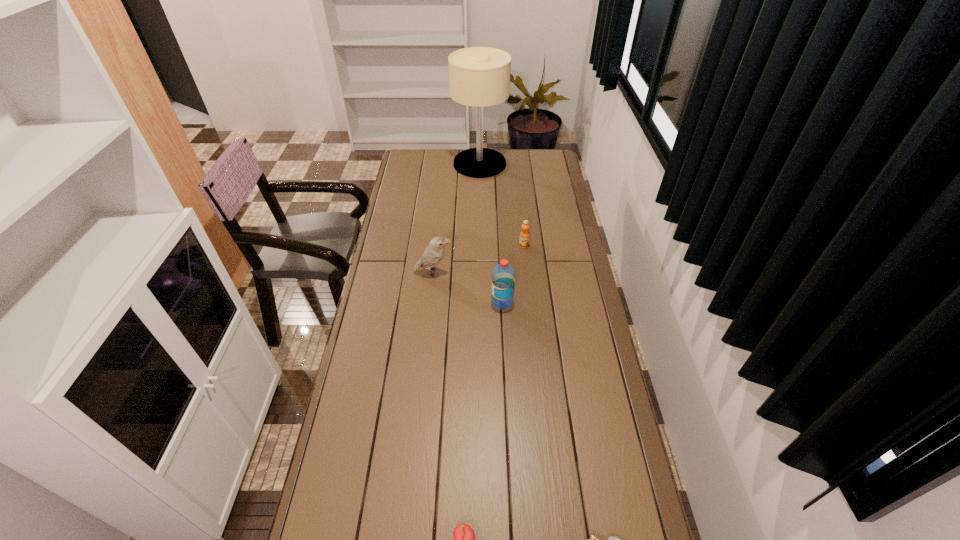
The height and width of the screenshot is (540, 960). In order to click on vacant region located at the face of the bird in this screenshot , I will do `click(524, 272)`.

Image resolution: width=960 pixels, height=540 pixels. Identify the location of vacant area located on the front label of the fourth tallest object. (526, 262).

Where is `object that is at the far edge`? object that is at the far edge is located at coordinates (478, 76).

Identify the location of object that is positioned at the left edge. (432, 255).

Where is `vacant area at the far edge of the desktop`? The image size is (960, 540). vacant area at the far edge of the desktop is located at coordinates (521, 159).

The height and width of the screenshot is (540, 960). I want to click on free space at the left edge of the desktop, so click(372, 403).

This screenshot has width=960, height=540. In order to click on free space at the right edge in this screenshot , I will do `click(546, 271)`.

Identify the location of free space at the far right corner of the desktop. The height and width of the screenshot is (540, 960). (546, 150).

Image resolution: width=960 pixels, height=540 pixels. In order to click on empty location between the farthest object and the fifth object from left to right in this screenshot , I will do `click(502, 205)`.

You are a GUI agent. You are given a task and a screenshot of the screen. Output one action in this format:
    pyautogui.click(x=<x>, y=<y>)
    Task: Click on the free space between the table lamp and the water bottle
    This screenshot has height=540, width=960.
    Given the screenshot: What is the action you would take?
    pyautogui.click(x=491, y=233)